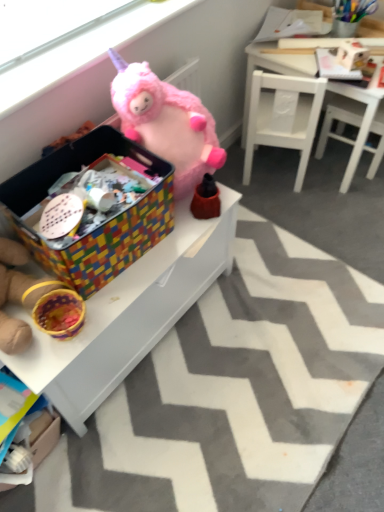
Question: Does fuzzy pink stuffed animal at upper center, which is counted as the 1th toy, starting from the top, have a larger size compared to multicolored woven basket at left, which is the third toy in top-to-bottom order?

Choices:
 (A) no
 (B) yes

Answer: (B)

Question: Is the depth of fuzzy pink stuffed animal at upper center, which is counted as the 1th toy, starting from the top, greater than that of multicolored woven basket at left, the 1th toy ordered from the bottom?

Choices:
 (A) yes
 (B) no

Answer: (A)

Question: From the image's perspective, would you say fuzzy pink stuffed animal at upper center, the 3th toy positioned from the bottom, is positioned over multicolored woven basket at left, the 1th toy ordered from the bottom?

Choices:
 (A) no
 (B) yes

Answer: (B)

Question: Considering the relative sizes of fuzzy pink stuffed animal at upper center, which is counted as the 1th toy, starting from the top, and multicolored woven basket at left, which is the third toy in top-to-bottom order, in the image provided, is fuzzy pink stuffed animal at upper center, which is counted as the 1th toy, starting from the top, smaller than multicolored woven basket at left, which is the third toy in top-to-bottom order,?

Choices:
 (A) no
 (B) yes

Answer: (A)

Question: Does fuzzy pink stuffed animal at upper center, which is counted as the 1th toy, starting from the top, have a greater width compared to multicolored woven basket at left, which is the third toy in top-to-bottom order?

Choices:
 (A) yes
 (B) no

Answer: (A)

Question: Is fuzzy pink stuffed animal at upper center, the 3th toy positioned from the bottom, outside of multicolored woven basket at left, the 1th toy ordered from the bottom?

Choices:
 (A) yes
 (B) no

Answer: (A)

Question: Is multicolored woven storage box at center to the left of cardboard box at lower left from the viewer's perspective?

Choices:
 (A) yes
 (B) no

Answer: (B)

Question: Is multicolored woven storage box at center oriented away from cardboard box at lower left?

Choices:
 (A) yes
 (B) no

Answer: (B)

Question: Is multicolored woven storage box at center in front of cardboard box at lower left?

Choices:
 (A) yes
 (B) no

Answer: (A)

Question: Could cardboard box at lower left be considered to be inside multicolored woven storage box at center?

Choices:
 (A) no
 (B) yes

Answer: (A)

Question: Is multicolored woven storage box at center directly adjacent to cardboard box at lower left?

Choices:
 (A) no
 (B) yes

Answer: (A)

Question: Is multicolored woven storage box at center shorter than cardboard box at lower left?

Choices:
 (A) yes
 (B) no

Answer: (B)

Question: Is white matte chair at upper right to the left of pink plush unicorn at upper center from the viewer's perspective?

Choices:
 (A) no
 (B) yes

Answer: (A)